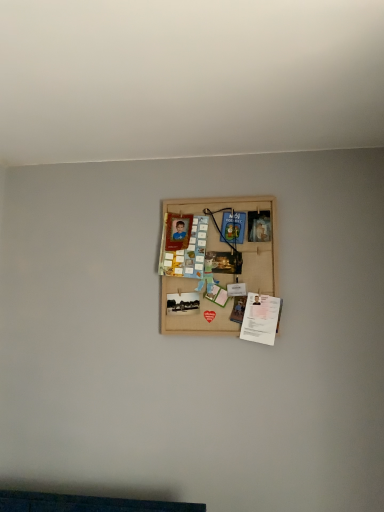
Question: Would you say bamboo mat board at center is inside or outside white paper at lower right?

Choices:
 (A) outside
 (B) inside

Answer: (A)

Question: Is point (165, 331) positioned closer to the camera than point (261, 325)?

Choices:
 (A) closer
 (B) farther

Answer: (B)

Question: From a real-world perspective, relative to white paper at lower right, is bamboo mat board at center vertically above or below?

Choices:
 (A) above
 (B) below

Answer: (A)

Question: Is white paper at lower right inside the boundaries of bamboo mat board at center, or outside?

Choices:
 (A) outside
 (B) inside

Answer: (B)

Question: Is point (248, 293) closer or farther from the camera than point (249, 220)?

Choices:
 (A) closer
 (B) farther

Answer: (A)

Question: From a real-world perspective, relative to bamboo mat board at center, is white paper at lower right vertically above or below?

Choices:
 (A) below
 (B) above

Answer: (A)

Question: Considering the positions of white paper at lower right and bamboo mat board at center in the image, is white paper at lower right taller or shorter than bamboo mat board at center?

Choices:
 (A) tall
 (B) short

Answer: (B)